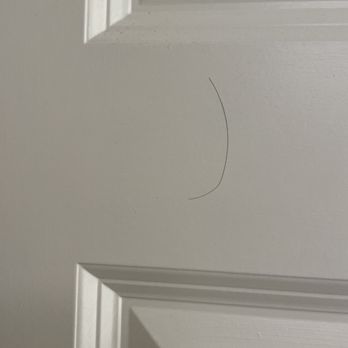
Image resolution: width=348 pixels, height=348 pixels. In order to click on wooden door in this screenshot , I will do `click(93, 138)`.